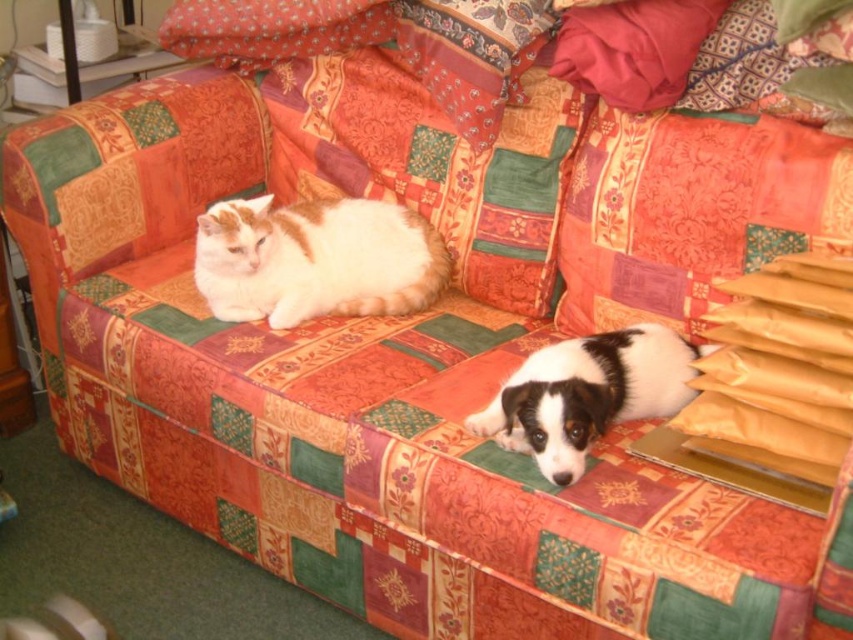
You are trying to make space for a new throw blanket on the sofa. The orange fabric pillow at upper right and the white and orange fur cat at center are currently occupying space. Which object takes up more horizontal space on the sofa?

The white and orange fur cat at center takes up more horizontal space on the sofa because the orange fabric pillow at upper right is narrower than it.

You are sitting on the colorful patchwork sofa and want to pet both the white and orange fur cat at center and the black and white fur at center. Which animal should you reach for first if you want to pet the one closer to your left side?

The white and orange fur cat at center is to the left of black and white fur at center, so you should reach for the white and orange fur cat at center first as it is closer to your left side.

You are an interior designer planning to place a new lamp on the sofa where the white and orange fur cat at center is currently lying. The lamp requires a 10cm x 10cm space. Can the lamp be placed there?

The white and orange fur cat at center is located at point [316,259], but without knowing the sofa dimensions or the cat size, it is impossible to determine if there is enough space for the lamp.